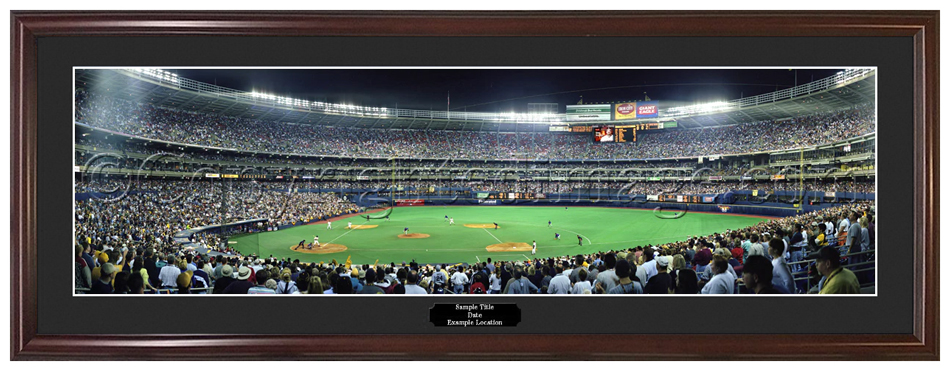
The image size is (950, 371). I want to click on reddish-brown wooden rectangular frame, so click(20, 18).